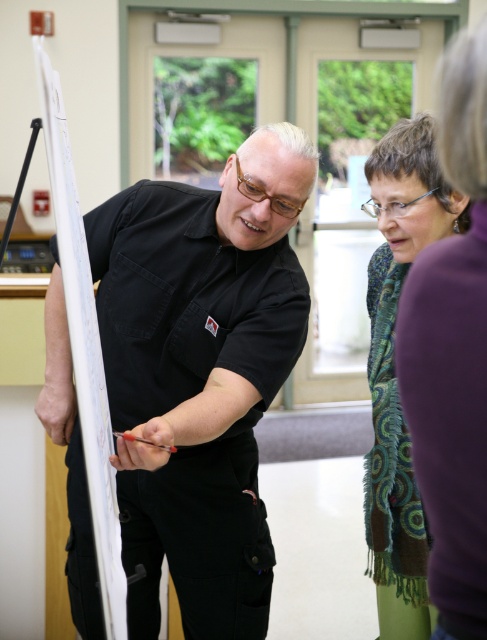
Question: Considering the real-world distances, which object is closest to the white paperboard at left?

Choices:
 (A) black cotton shirt at center
 (B) green textured scarf at center

Answer: (A)

Question: Can you confirm if green textured scarf at center is positioned below white paperboard at left?

Choices:
 (A) no
 (B) yes

Answer: (B)

Question: Which of these objects is positioned closest to the black cotton shirt at center?

Choices:
 (A) white paperboard at left
 (B) green textured scarf at center

Answer: (A)

Question: Which object appears closest to the camera in this image?

Choices:
 (A) black cotton shirt at center
 (B) green textured scarf at center
 (C) white paperboard at left

Answer: (C)

Question: Is black cotton shirt at center thinner than white paperboard at left?

Choices:
 (A) no
 (B) yes

Answer: (A)

Question: Can you confirm if black cotton shirt at center is bigger than green textured scarf at center?

Choices:
 (A) no
 (B) yes

Answer: (B)